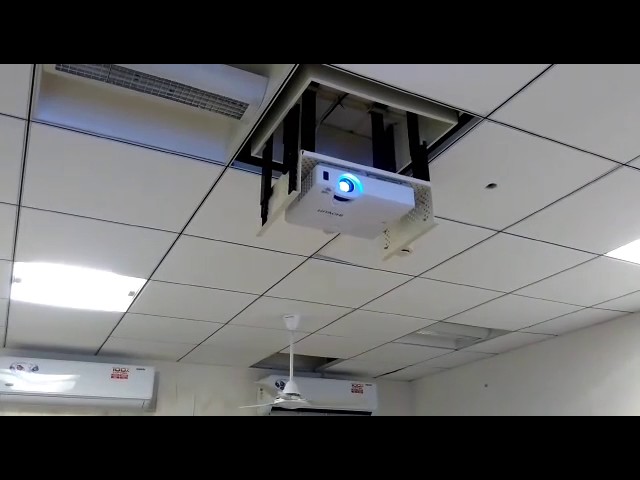
In order to click on projector lens in this screenshot , I will do `click(346, 185)`.